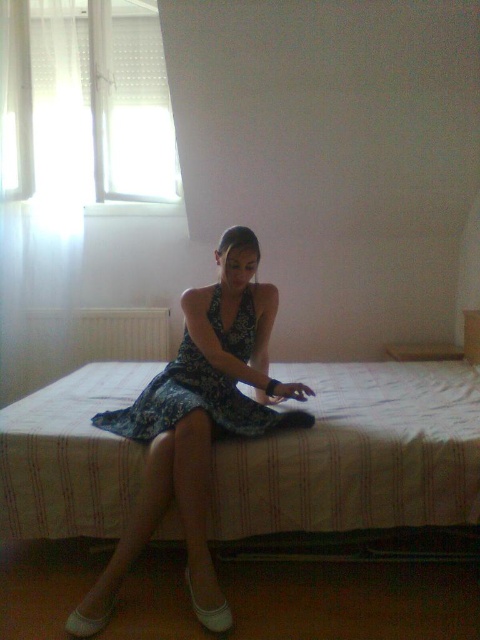
From the picture: Who is higher up, white striped mattress at center or blue floral dress at center?

white striped mattress at center

Who is more forward, (x=417, y=429) or (x=285, y=385)?

Point (x=417, y=429) is in front.

Does point (409, 474) lie behind point (193, 358)?

No.

Image resolution: width=480 pixels, height=640 pixels. In order to click on white striped mattress at center in this screenshot , I will do `click(359, 454)`.

Is blue floral dress at center taller than printed fabric dress at center?

Correct, blue floral dress at center is much taller as printed fabric dress at center.

Who is more distant from viewer, [152,493] or [216,400]?

The point [216,400] is behind.

Measure the distance between blue floral dress at center and camera.

The distance of blue floral dress at center from camera is 1.76 meters.

Find the location of a particular element. The width and height of the screenshot is (480, 640). blue floral dress at center is located at coordinates (197, 422).

Is white striped mattress at center wider than printed fabric dress at center?

Yes, white striped mattress at center is wider than printed fabric dress at center.

Locate an element on the screen. This screenshot has height=640, width=480. white striped mattress at center is located at coordinates (359, 454).

The height and width of the screenshot is (640, 480). I want to click on white striped mattress at center, so click(x=359, y=454).